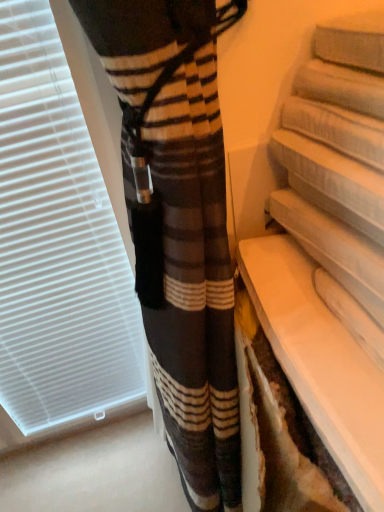
The height and width of the screenshot is (512, 384). What do you see at coordinates (331, 248) in the screenshot?
I see `white glossy shelf at lower right` at bounding box center [331, 248].

Locate an element on the screen. The width and height of the screenshot is (384, 512). white glossy shelf at lower right is located at coordinates (331, 248).

Find the location of a particular element. This screenshot has width=384, height=512. white plastic window blind at left is located at coordinates (57, 242).

What do you see at coordinates (57, 242) in the screenshot? The image size is (384, 512). I see `white plastic window blind at left` at bounding box center [57, 242].

Identify the location of white glossy shelf at lower right. (331, 248).

Is white plastic window blind at left to the left of white glossy shelf at lower right from the viewer's perspective?

Yes, white plastic window blind at left is to the left of white glossy shelf at lower right.

Considering the positions of objects white plastic window blind at left and white glossy shelf at lower right in the image provided, who is behind, white plastic window blind at left or white glossy shelf at lower right?

white plastic window blind at left is behind.

Does point (22, 367) come in front of point (306, 301)?

No, (22, 367) is further to viewer.

From the image's perspective, does white plastic window blind at left appear lower than white glossy shelf at lower right?

No, from the image's perspective, white plastic window blind at left is not beneath white glossy shelf at lower right.

From a real-world perspective, is white plastic window blind at left positioned above or below white glossy shelf at lower right?

white plastic window blind at left is situated lower than white glossy shelf at lower right in the real world.

Which object is wider, white plastic window blind at left or white glossy shelf at lower right?

white glossy shelf at lower right is wider.

From the picture: In terms of height, does white plastic window blind at left look taller or shorter compared to white glossy shelf at lower right?

Considering their sizes, white plastic window blind at left has more height than white glossy shelf at lower right.

Considering the relative sizes of white plastic window blind at left and white glossy shelf at lower right in the image provided, is white plastic window blind at left smaller than white glossy shelf at lower right?

No.

Is white glossy shelf at lower right completely or partially inside white plastic window blind at left?

No, white glossy shelf at lower right is located outside of white plastic window blind at left.

Is white plastic window blind at left next to white glossy shelf at lower right?

white plastic window blind at left is not next to white glossy shelf at lower right, and they're not touching.

Is white plastic window blind at left turned away from white glossy shelf at lower right?

No.

Measure the distance from white plastic window blind at left to white glossy shelf at lower right.

A distance of 18.73 inches exists between white plastic window blind at left and white glossy shelf at lower right.

I want to click on shelf on the right of white plastic window blind at left, so click(x=331, y=248).

Which is more to the right, white glossy shelf at lower right or white plastic window blind at left?

white glossy shelf at lower right is more to the right.

In the image, is white glossy shelf at lower right positioned in front of or behind white plastic window blind at left?

Visually, white glossy shelf at lower right is located in front of white plastic window blind at left.

Which point is more distant from viewer, (353, 140) or (67, 97)?

The point (67, 97) is farther.

From the image's perspective, which one is positioned higher, white glossy shelf at lower right or white plastic window blind at left?

white plastic window blind at left appears higher in the image.

From a real-world perspective, between white glossy shelf at lower right and white plastic window blind at left, who is vertically lower?

white plastic window blind at left.

Can you confirm if white glossy shelf at lower right is wider than white plastic window blind at left?

Yes.

Who is taller, white glossy shelf at lower right or white plastic window blind at left?

Standing taller between the two is white plastic window blind at left.

Considering the sizes of objects white glossy shelf at lower right and white plastic window blind at left in the image provided, who is smaller, white glossy shelf at lower right or white plastic window blind at left?

white glossy shelf at lower right is smaller.

Is white plastic window blind at left located within white glossy shelf at lower right?

No.

Are white glossy shelf at lower right and white plastic window blind at left far apart?

white glossy shelf at lower right is actually quite close to white plastic window blind at left.

Is white glossy shelf at lower right oriented towards white plastic window blind at left?

No.

How different are the orientations of white glossy shelf at lower right and white plastic window blind at left in degrees?

white glossy shelf at lower right and white plastic window blind at left are facing 0.546 degrees away from each other.

In order to click on window blind above the white glossy shelf at lower right (from the image's perspective) in this screenshot , I will do `click(57, 242)`.

Where is `shelf that appears in front of the white plastic window blind at left`? The width and height of the screenshot is (384, 512). shelf that appears in front of the white plastic window blind at left is located at coordinates (331, 248).

Where is `window blind on the left of the white glossy shelf at lower right`? This screenshot has height=512, width=384. window blind on the left of the white glossy shelf at lower right is located at coordinates (57, 242).